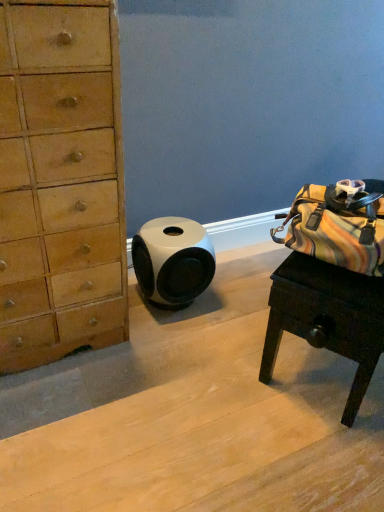
The width and height of the screenshot is (384, 512). Find the location of `free spot in front of white glossy speaker at center`. free spot in front of white glossy speaker at center is located at coordinates (170, 342).